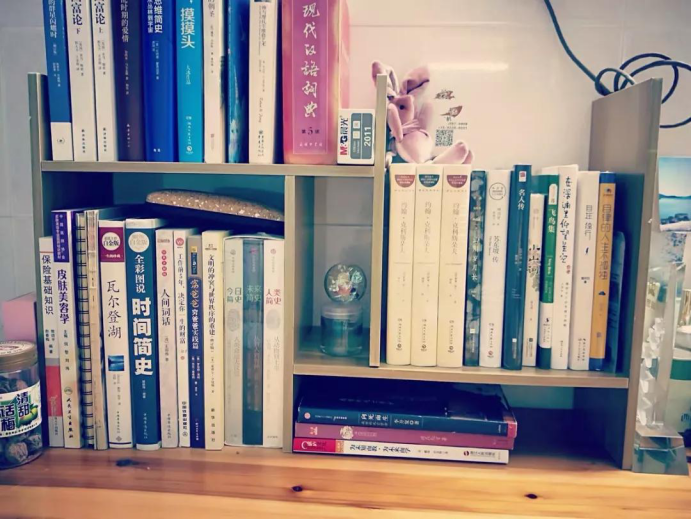
Where is `blue or green book`? This screenshot has width=692, height=519. blue or green book is located at coordinates (55, 61), (154, 79), (188, 81), (233, 81), (140, 340), (194, 343), (509, 307), (545, 284), (459, 420).